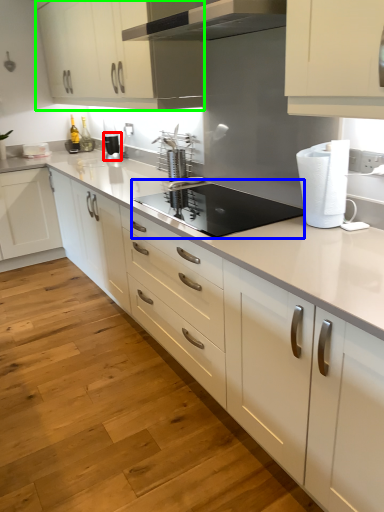
Question: Based on their relative distances, which object is farther from kitchen appliance (highlighted by a red box)? Choose from appliance (highlighted by a blue box) and cabinetry (highlighted by a green box).

Choices:
 (A) appliance
 (B) cabinetry

Answer: (A)